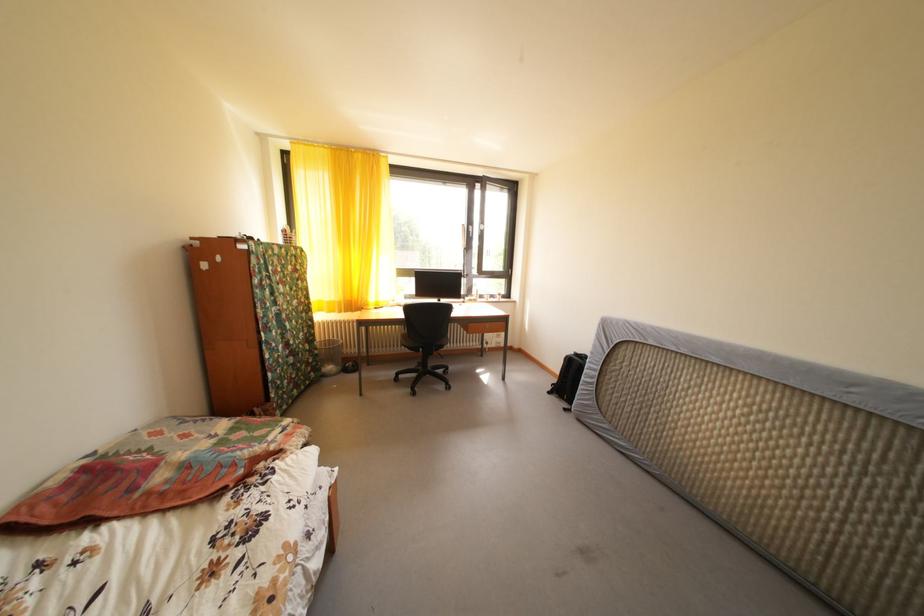
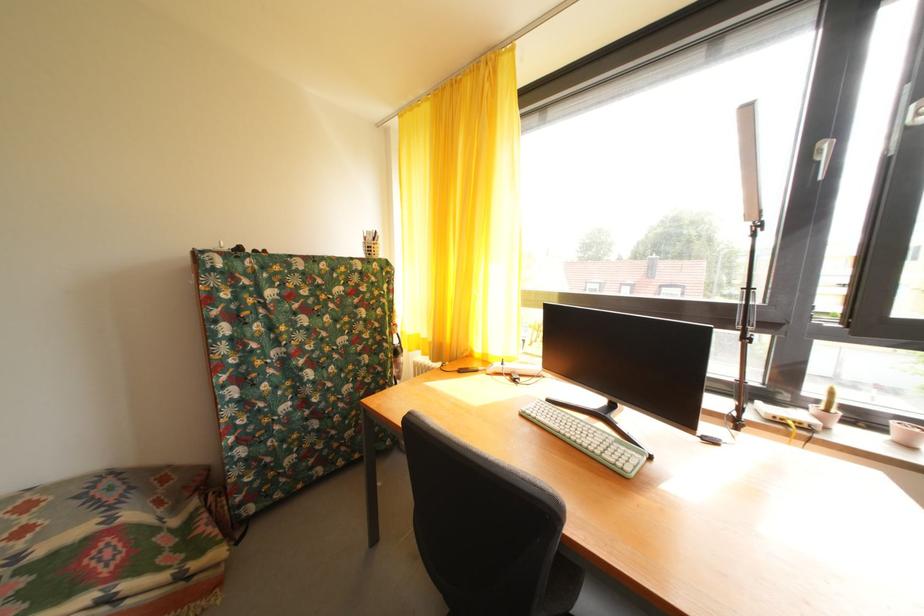
The point at (195, 442) is marked in the first image. Where is the corresponding point in the second image?

(31, 538)